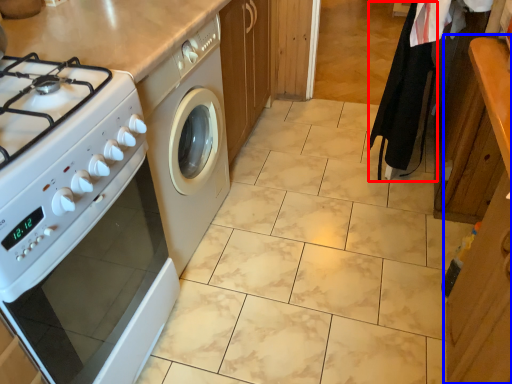
Question: Which point is further to the camera, robe (highlighted by a red box) or cabinetry (highlighted by a blue box)?

Choices:
 (A) robe
 (B) cabinetry

Answer: (A)